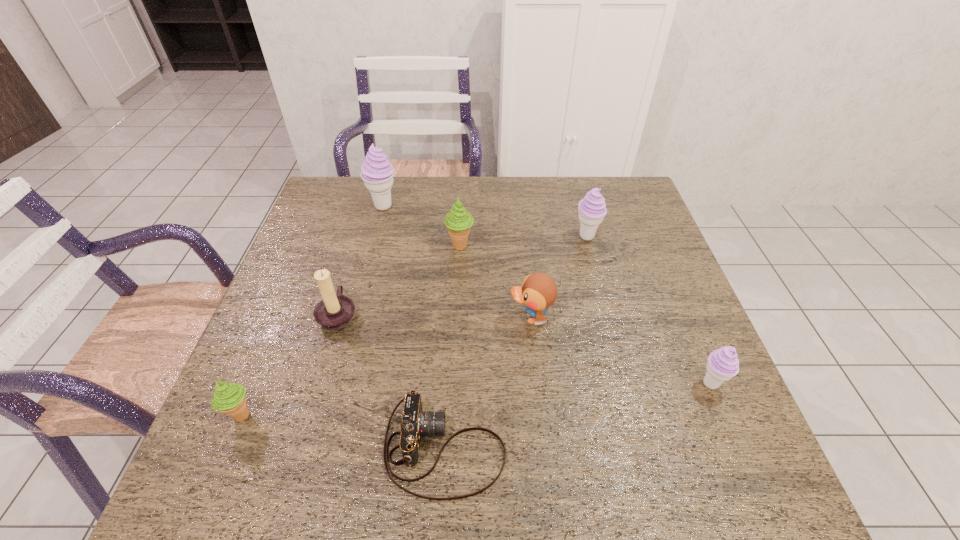
In order to click on free location that satisfies the following two spatial constraints: 1. on the wick of the brown candle holder; 2. on the right side of the fourth farthest icecream in this screenshot , I will do `click(318, 383)`.

The width and height of the screenshot is (960, 540). In order to click on free space that satisfies the following two spatial constraints: 1. on the front side of the second object from right to left; 2. on the front-facing side of the blue duck in this screenshot , I will do `click(609, 318)`.

Locate an element on the screen. This screenshot has height=540, width=960. free region that satisfies the following two spatial constraints: 1. on the back side of the rightmost purple icecream; 2. on the front-facing side of the sixth object from left to right is located at coordinates (683, 318).

Image resolution: width=960 pixels, height=540 pixels. What are the coordinates of `vacant region that satisfies the following two spatial constraints: 1. on the front side of the farthest object; 2. on the left side of the bigger green icecream` in the screenshot? It's located at (373, 246).